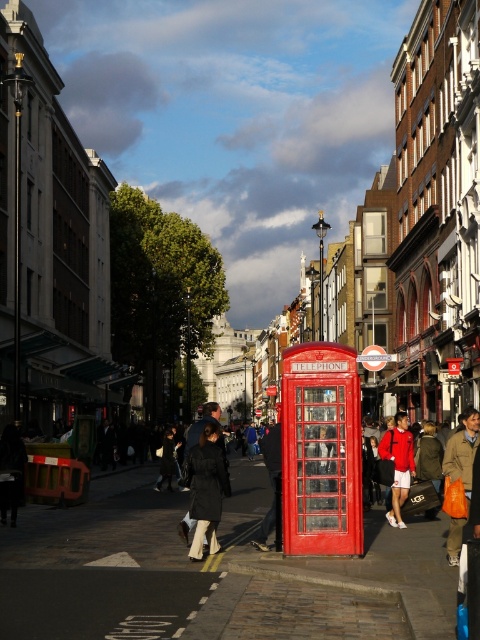
Measure the distance between black puffy coat at center and orange fabric bag at center.

black puffy coat at center and orange fabric bag at center are 11.32 feet apart.

Is black puffy coat at center to the left of orange fabric bag at center from the viewer's perspective?

Indeed, black puffy coat at center is positioned on the left side of orange fabric bag at center.

I want to click on black puffy coat at center, so click(x=205, y=488).

The height and width of the screenshot is (640, 480). In order to click on black puffy coat at center in this screenshot , I will do `click(205, 488)`.

Does black puffy coat at center have a greater height compared to red fabric jacket at center?

No.

At what (x,y) coordinates should I click in order to perform the action: click on black puffy coat at center. Please return your answer as a coordinate pair (x, y). Looking at the image, I should click on (205, 488).

Is orange fabric bag at center smaller than red fabric jacket at center?

No, orange fabric bag at center is not smaller than red fabric jacket at center.

Does orange fabric bag at center have a greater width compared to red fabric jacket at center?

Yes.

Which is in front, point (477, 413) or point (405, 452)?

Positioned in front is point (477, 413).

Image resolution: width=480 pixels, height=640 pixels. Find the location of `orange fabric bag at center`. orange fabric bag at center is located at coordinates [460, 474].